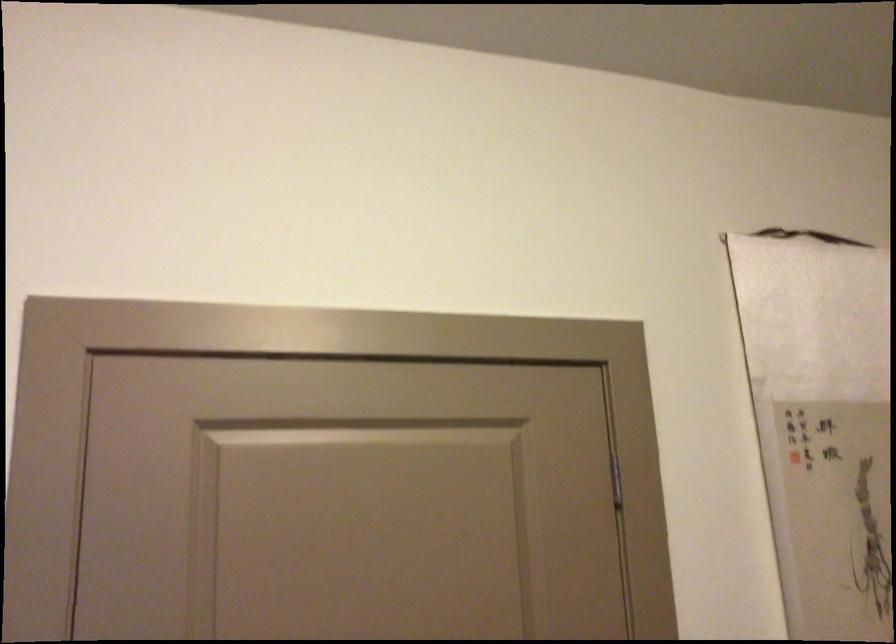
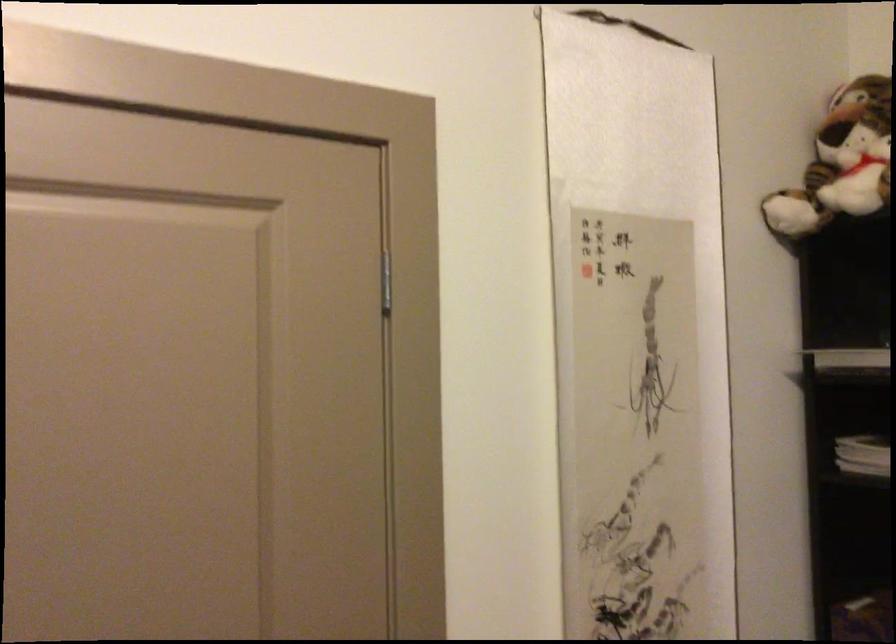
Question: The images are taken continuously from a first-person perspective. In which direction is your viewpoint rotating?

Choices:
 (A) Left
 (B) Right
 (C) Up
 (D) Down

Answer: (B)